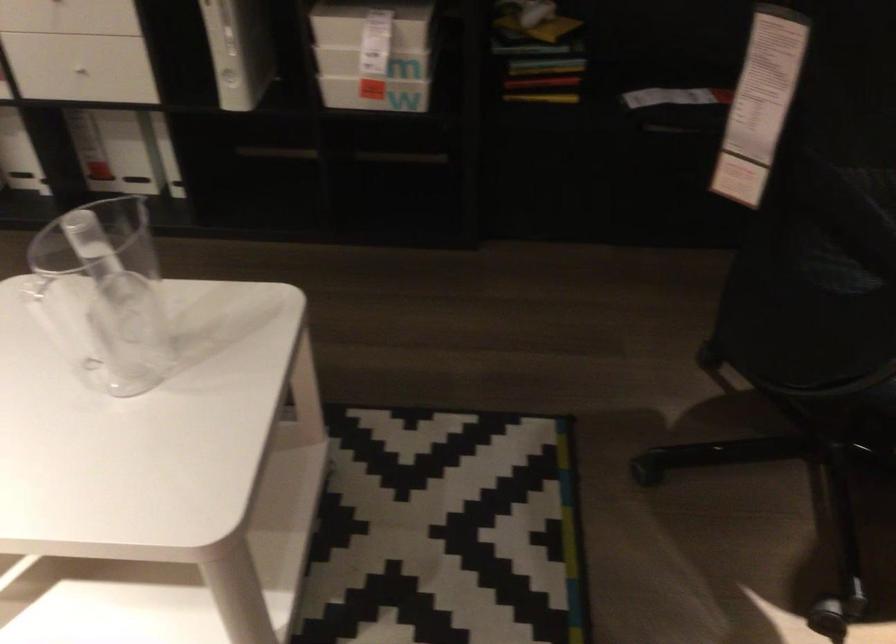
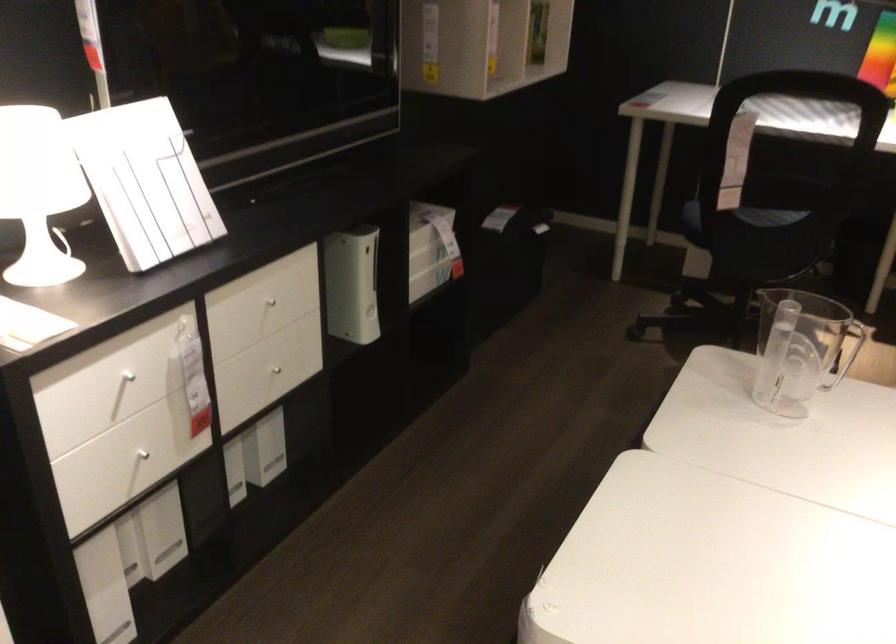
Find the pixel in the second image that matches (x=147, y=71) in the first image.

(279, 366)